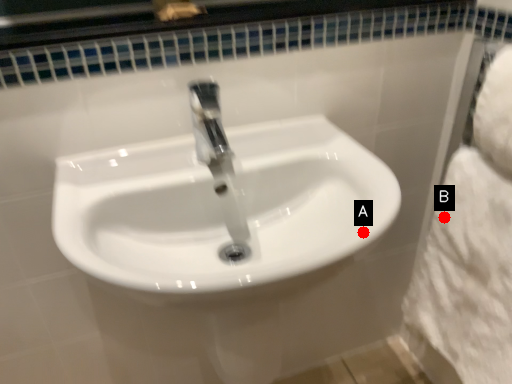
Question: Two points are circled on the image, labeled by A and B beside each circle. Which point is farther to the camera?

Choices:
 (A) A is further
 (B) B is further

Answer: (B)